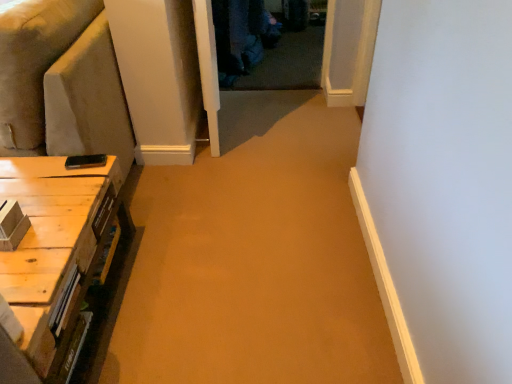
Question: From the image's perspective, is suede-like beige couch at left positioned above or below light brown wood table at lower left?

Choices:
 (A) above
 (B) below

Answer: (A)

Question: Looking at their shapes, would you say suede-like beige couch at left is wider or thinner than light brown wood table at lower left?

Choices:
 (A) wide
 (B) thin

Answer: (A)

Question: From a real-world perspective, relative to light brown wood table at lower left, is suede-like beige couch at left vertically above or below?

Choices:
 (A) above
 (B) below

Answer: (A)

Question: Would you say light brown wood table at lower left is to the left or to the right of suede-like beige couch at left in the picture?

Choices:
 (A) left
 (B) right

Answer: (B)

Question: Based on their sizes in the image, would you say light brown wood table at lower left is bigger or smaller than suede-like beige couch at left?

Choices:
 (A) small
 (B) big

Answer: (A)

Question: In terms of height, does light brown wood table at lower left look taller or shorter compared to suede-like beige couch at left?

Choices:
 (A) short
 (B) tall

Answer: (A)

Question: Relative to suede-like beige couch at left, is light brown wood table at lower left in front or behind?

Choices:
 (A) front
 (B) behind

Answer: (A)